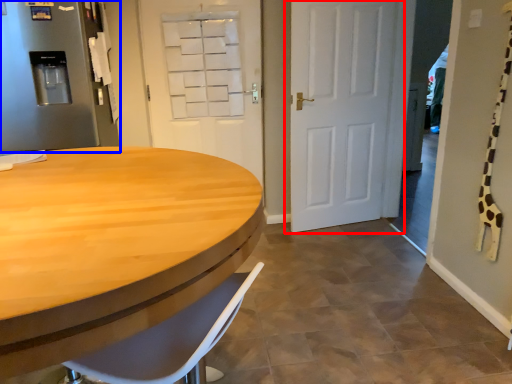
Question: Which object is further to the camera taking this photo, door (highlighted by a red box) or refrigerator (highlighted by a blue box)?

Choices:
 (A) door
 (B) refrigerator

Answer: (A)